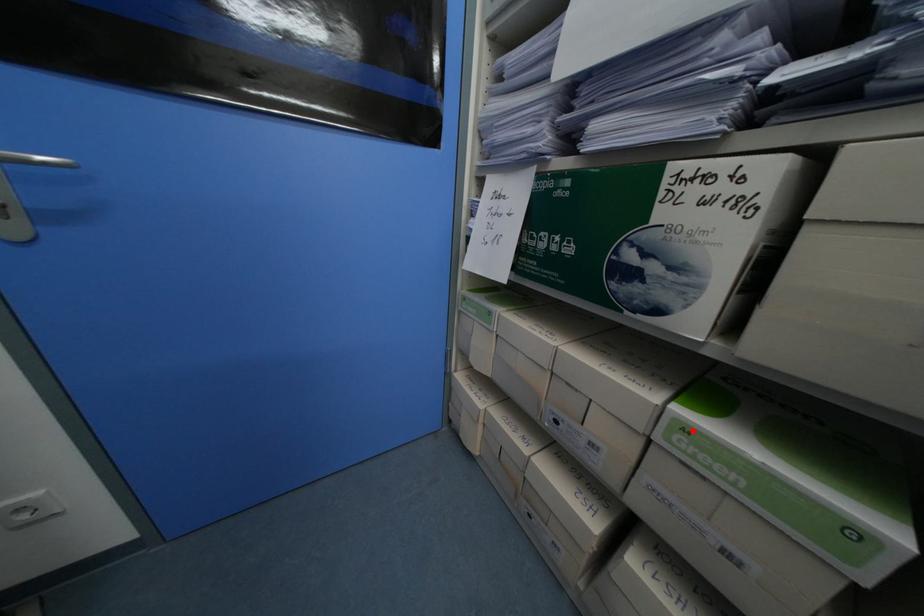
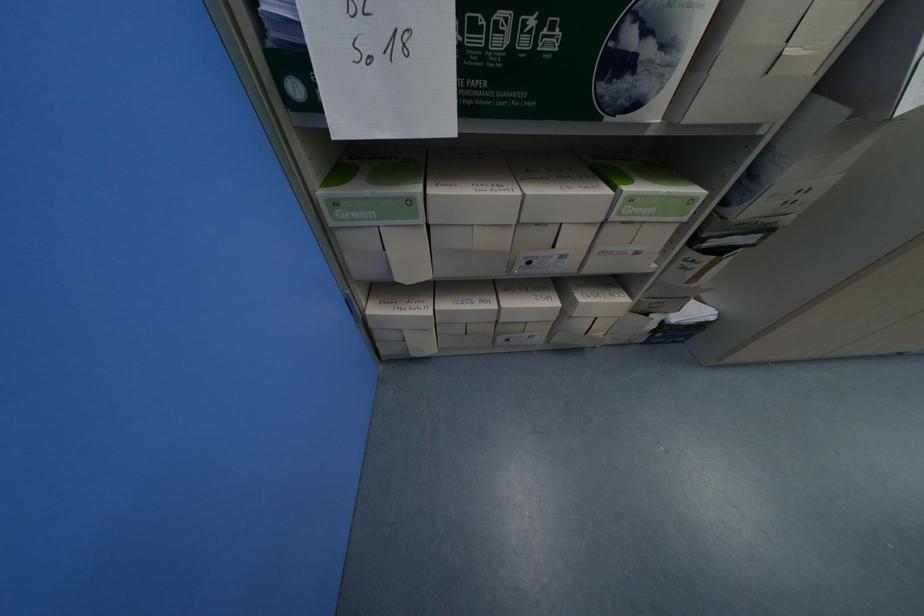
Find the pixel in the second image that matches the highlighted location in the first image.

(638, 200)